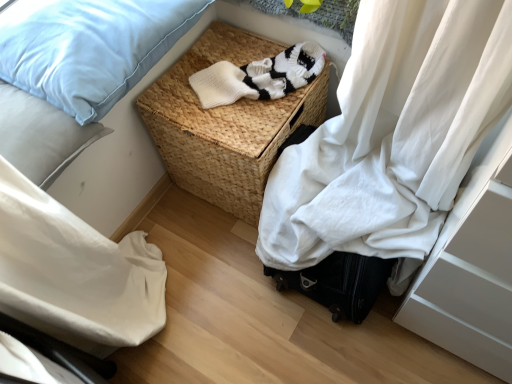
Identify the location of free point above light blue fabric pillow at upper left, acting as the 2th pillow starting from the bottom (from a real-world perspective). Image resolution: width=512 pixels, height=384 pixels. (64, 21).